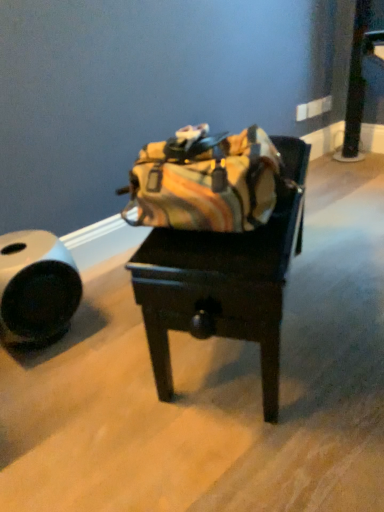
Image resolution: width=384 pixels, height=512 pixels. Identify the location of vacant area that is situated to the right of leather duffel bag at center. (339, 283).